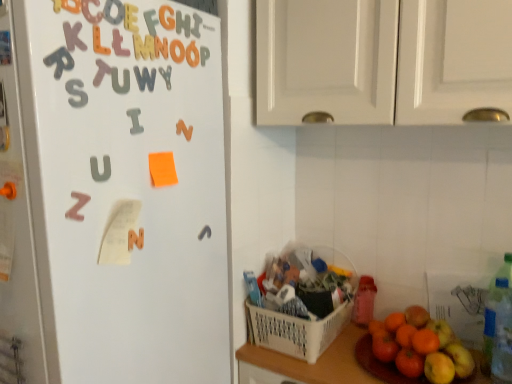
Question: From a real-world perspective, is pink matte letter z at left, which is counted as the 7th alphabet, starting from the top, positioned over white matte cabinet doors at upper center based on gravity?

Choices:
 (A) no
 (B) yes

Answer: (A)

Question: Is the depth of pink matte letter z at left, which is the seventh alphabet from right to left, less than that of white matte cabinet doors at upper center?

Choices:
 (A) no
 (B) yes

Answer: (B)

Question: Is pink matte letter z at left, which is counted as the 7th alphabet, starting from the top, shorter than white matte cabinet doors at upper center?

Choices:
 (A) no
 (B) yes

Answer: (B)

Question: Is white matte cabinet doors at upper center surrounded by pink matte letter z at left, which is counted as the 7th alphabet, starting from the top?

Choices:
 (A) yes
 (B) no

Answer: (B)

Question: Considering the relative sizes of pink matte letter z at left, which is the seventh alphabet from right to left, and white matte cabinet doors at upper center in the image provided, is pink matte letter z at left, which is the seventh alphabet from right to left, smaller than white matte cabinet doors at upper center?

Choices:
 (A) yes
 (B) no

Answer: (A)

Question: Choose the correct answer: Is pink matte letter z at left, which is the seventh alphabet from right to left, inside metallic silver letter at upper center, which ranks as the first alphabet in right-to-left order, or outside it?

Choices:
 (A) outside
 (B) inside

Answer: (A)

Question: Looking at their shapes, would you say pink matte letter z at left, which is counted as the 7th alphabet, starting from the top, is wider or thinner than metallic silver letter at upper center, placed as the 7th alphabet when sorted from bottom to top?

Choices:
 (A) wide
 (B) thin

Answer: (B)

Question: In the image, is pink matte letter z at left, arranged as the first alphabet when viewed from the left, positioned in front of or behind metallic silver letter at upper center, which ranks as the first alphabet in right-to-left order?

Choices:
 (A) front
 (B) behind

Answer: (A)

Question: Considering the positions of point (78, 200) and point (198, 31), is point (78, 200) closer or farther from the camera than point (198, 31)?

Choices:
 (A) farther
 (B) closer

Answer: (B)

Question: Which is correct: metallic silver letter at upper center, placed as the 7th alphabet when sorted from bottom to top, is inside white matte cabinet doors at upper center, or outside of it?

Choices:
 (A) outside
 (B) inside

Answer: (A)

Question: From the image's perspective, relative to white matte cabinet doors at upper center, is metallic silver letter at upper center, which ranks as the first alphabet in right-to-left order, above or below?

Choices:
 (A) above
 (B) below

Answer: (A)

Question: Looking at their shapes, would you say metallic silver letter at upper center, which ranks as the first alphabet in right-to-left order, is wider or thinner than white matte cabinet doors at upper center?

Choices:
 (A) wide
 (B) thin

Answer: (B)

Question: Does point (192, 29) appear closer or farther from the camera than point (338, 1)?

Choices:
 (A) farther
 (B) closer

Answer: (B)

Question: In terms of size, does orange matte grapefruit at lower right appear bigger or smaller than matte plastic letter at upper center, positioned as the 3th alphabet in bottom-to-top order?

Choices:
 (A) big
 (B) small

Answer: (A)

Question: From a real-world perspective, is orange matte grapefruit at lower right positioned above or below matte plastic letter at upper center, the fifth alphabet when ordered from top to bottom?

Choices:
 (A) below
 (B) above

Answer: (A)